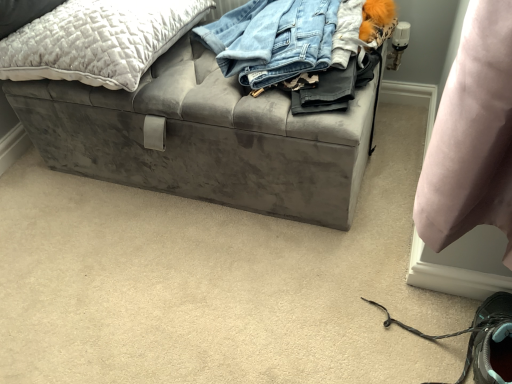
Question: Is gray suede shoe at lower right in front of or behind velvet gray storage bench at center in the image?

Choices:
 (A) behind
 (B) front

Answer: (B)

Question: Looking at the image, does gray suede shoe at lower right seem bigger or smaller compared to velvet gray storage bench at center?

Choices:
 (A) small
 (B) big

Answer: (A)

Question: Which object is positioned closest to the gray suede shoe at lower right?

Choices:
 (A) velvet gray storage bench at center
 (B) quilted gray pillow at upper left

Answer: (A)

Question: Which object is the farthest from the gray suede shoe at lower right?

Choices:
 (A) velvet gray storage bench at center
 (B) quilted gray pillow at upper left

Answer: (B)